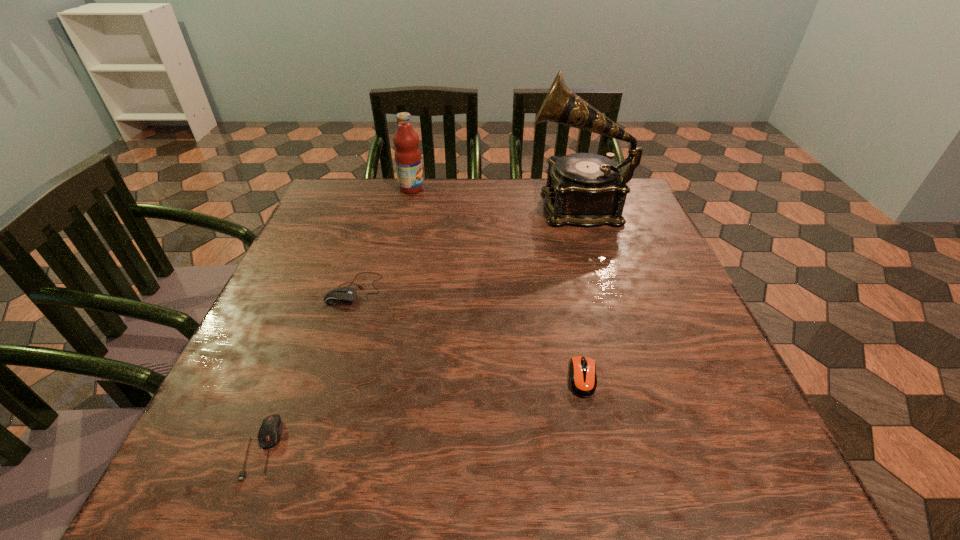
Where is `phonograph record`? phonograph record is located at coordinates (583, 189).

You are a GUI agent. You are given a task and a screenshot of the screen. Output one action in this format:
    pyautogui.click(x=<x>, y=<y>)
    Task: Click on the fruit juice
    
    Given the screenshot: What is the action you would take?
    [407, 154]

The image size is (960, 540). I want to click on the third nearest object, so click(344, 295).

Find the location of a particular element. the rightmost mouse is located at coordinates (583, 382).

In order to click on the fourth farthest object in this screenshot , I will do `click(583, 382)`.

You are a GUI agent. You are given a task and a screenshot of the screen. Output one action in this format:
    pyautogui.click(x=<x>, y=<y>)
    Task: Click on the nearest object
    This screenshot has height=540, width=960.
    Given the screenshot: What is the action you would take?
    pyautogui.click(x=270, y=431)

You are a GUI agent. You are given a task and a screenshot of the screen. Output one action in this format:
    pyautogui.click(x=<x>, y=<y>)
    Task: Click on the vacant region located 0.160m on the horn of the tallest object
    This screenshot has height=540, width=960.
    Given the screenshot: What is the action you would take?
    pyautogui.click(x=468, y=205)

I want to click on blank space located 0.130m on the horn of the tallest object, so click(x=479, y=205).

Image resolution: width=960 pixels, height=540 pixels. Identify the location of free space located on the horn of the tallest object. (x=461, y=205).

The height and width of the screenshot is (540, 960). I want to click on vacant space located 0.290m on the front label of the fourth shortest object, so click(x=527, y=188).